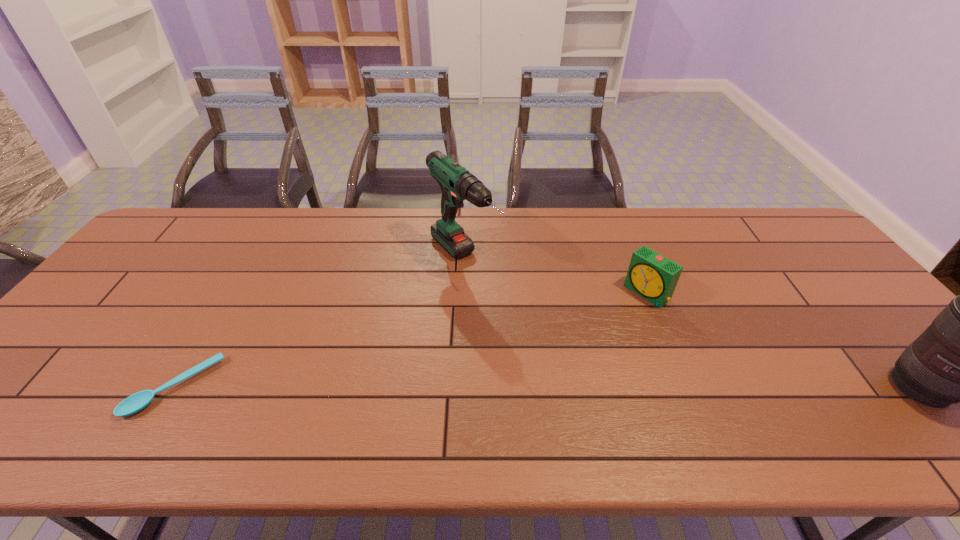
Locate an element on the screen. The width and height of the screenshot is (960, 540). vacant area situated 0.400m on the front-facing side of the third object from left to right is located at coordinates (531, 382).

What are the coordinates of `free location located on the front-facing side of the third object from left to right` in the screenshot? It's located at (585, 341).

At what (x,y) coordinates should I click in order to perform the action: click on vacant position located 0.160m on the front-facing side of the third object from left to right. Please return your answer as a coordinate pair (x, y). Looking at the image, I should click on (597, 332).

Where is `object at the far edge`? The width and height of the screenshot is (960, 540). object at the far edge is located at coordinates click(457, 184).

Find the location of `object situated at the near edge`. object situated at the near edge is located at coordinates (136, 402).

In the image, there is a desktop. Identify the location of vacant space at the far edge. This screenshot has height=540, width=960. (721, 212).

Where is `vacant point at the near edge`? Image resolution: width=960 pixels, height=540 pixels. vacant point at the near edge is located at coordinates (814, 391).

The height and width of the screenshot is (540, 960). In order to click on vacant space at the left edge of the desktop in this screenshot , I will do `click(98, 370)`.

Identify the location of free space at the right edge. The height and width of the screenshot is (540, 960). click(826, 278).

In the image, there is a desktop. Where is `vacant region at the far right corner`? Image resolution: width=960 pixels, height=540 pixels. vacant region at the far right corner is located at coordinates (765, 210).